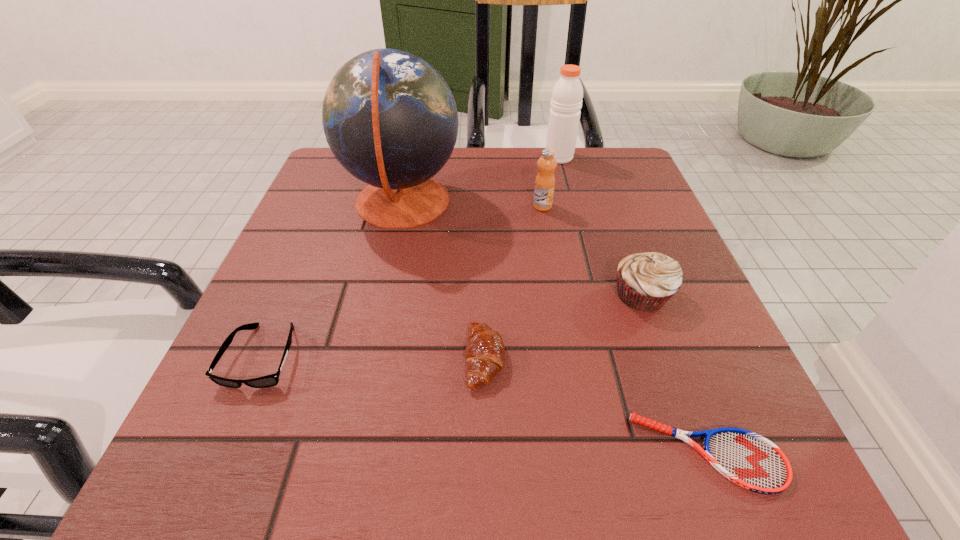
Image resolution: width=960 pixels, height=540 pixels. Identify the location of vacant space that satisfies the following two spatial constraints: 1. with the Americas facing the viewer on the tallest object; 2. on the front-facing side of the sunglasses. [x=369, y=356].

Image resolution: width=960 pixels, height=540 pixels. What are the coordinates of `vacant point that satisfies the following two spatial constraints: 1. with the Americas facing the viewer on the fourth tallest object; 2. on the left side of the tallest object` in the screenshot? It's located at (382, 294).

Find the location of a particular element. The height and width of the screenshot is (540, 960). free space that satisfies the following two spatial constraints: 1. with the Americas facing the viewer on the globe; 2. on the back side of the third object from left to right is located at coordinates (368, 359).

The image size is (960, 540). I want to click on vacant space that satisfies the following two spatial constraints: 1. with the Americas facing the viewer on the globe; 2. on the right side of the fourth nearest object, so click(x=382, y=294).